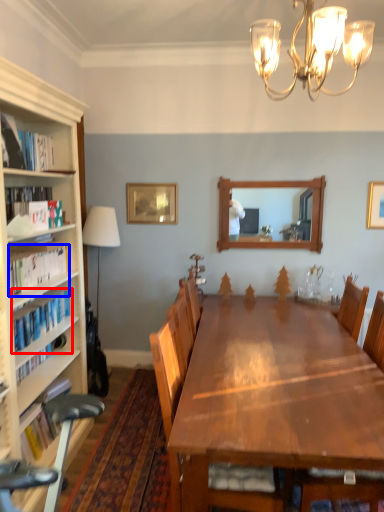
Question: Which object appears farthest to the camera in this image, book (highlighted by a red box) or book (highlighted by a blue box)?

Choices:
 (A) book
 (B) book

Answer: (A)